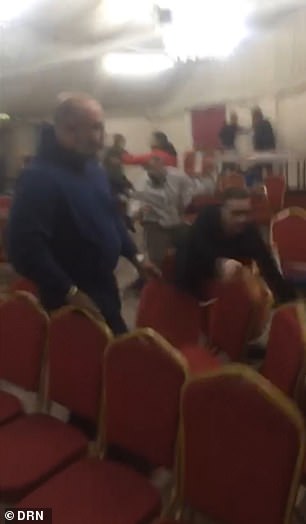
Locate an element on the screen. This screenshot has height=524, width=306. theater seat is located at coordinates (154, 361).